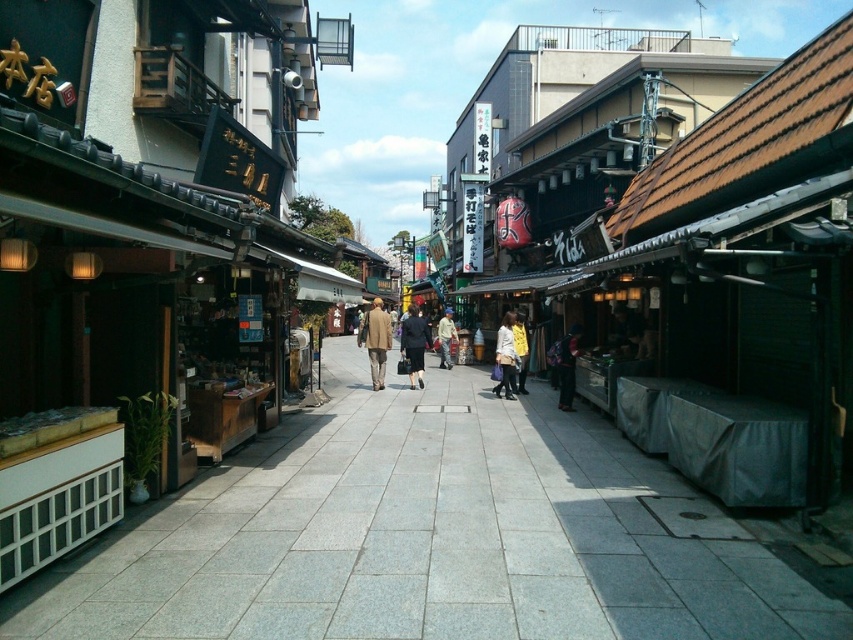
Is yellow matte jacket at center closer to the viewer compared to yellow fabric bag at center?

Yes, it is in front of yellow fabric bag at center.

Between yellow matte jacket at center and yellow fabric bag at center, which one is positioned higher?

yellow fabric bag at center is higher up.

Describe the element at coordinates (520, 352) in the screenshot. This screenshot has width=853, height=640. I see `yellow matte jacket at center` at that location.

Find the location of `yellow matte jacket at center`. yellow matte jacket at center is located at coordinates (520, 352).

Which is in front, point (567, 364) or point (515, 385)?

Point (567, 364) is more forward.

Is dark blue fabric jacket at center bigger than yellow matte jacket at center?

No, dark blue fabric jacket at center is not bigger than yellow matte jacket at center.

Describe the element at coordinates (567, 368) in the screenshot. I see `dark blue fabric jacket at center` at that location.

The image size is (853, 640). Find the location of `dark blue fabric jacket at center`. dark blue fabric jacket at center is located at coordinates (567, 368).

Who is positioned more to the right, gray stone pavement at center or matte black coat at center?

gray stone pavement at center is more to the right.

Does gray stone pavement at center have a greater width compared to matte black coat at center?

Yes.

Is point (219, 604) less distant than point (412, 312)?

That is True.

Locate an element on the screen. The width and height of the screenshot is (853, 640). gray stone pavement at center is located at coordinates (427, 536).